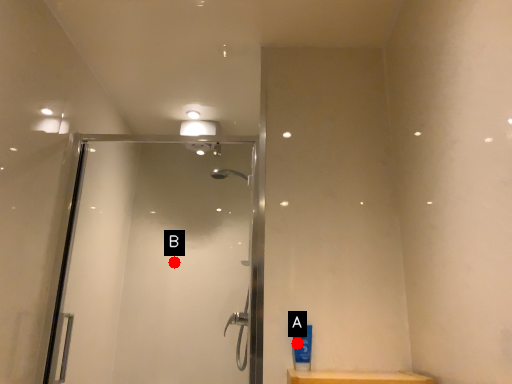
Question: Two points are circled on the image, labeled by A and B beside each circle. Which point is farther to the camera?

Choices:
 (A) A is further
 (B) B is further

Answer: (B)